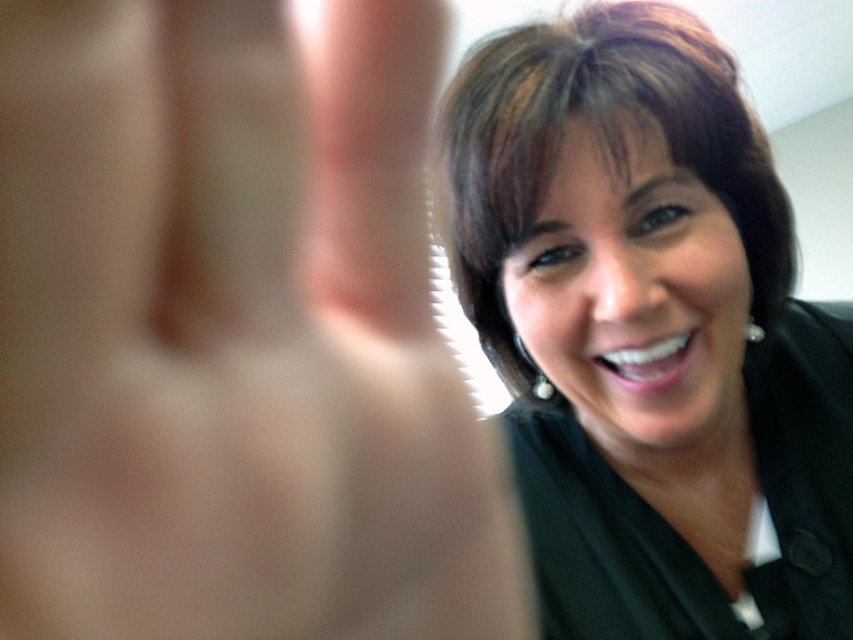
Who is more forward, (62, 339) or (518, 216)?

Point (62, 339) is in front.

Image resolution: width=853 pixels, height=640 pixels. What do you see at coordinates (231, 336) in the screenshot?
I see `smooth skin hand at center` at bounding box center [231, 336].

Which is in front, point (445, 461) or point (459, 170)?

Point (445, 461)

You are a GUI agent. You are given a task and a screenshot of the screen. Output one action in this format:
    pyautogui.click(x=<x>, y=<y>)
    Task: Click on the smooth skin hand at center
    Image resolution: width=853 pixels, height=640 pixels.
    Given the screenshot: What is the action you would take?
    pyautogui.click(x=231, y=336)